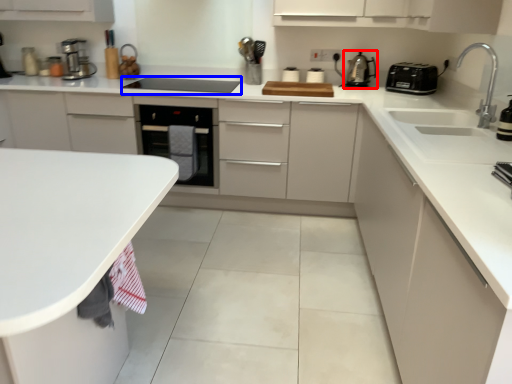
Question: Which object is further to the camera taking this photo, kitchen appliance (highlighted by a red box) or appliance (highlighted by a blue box)?

Choices:
 (A) kitchen appliance
 (B) appliance

Answer: (A)